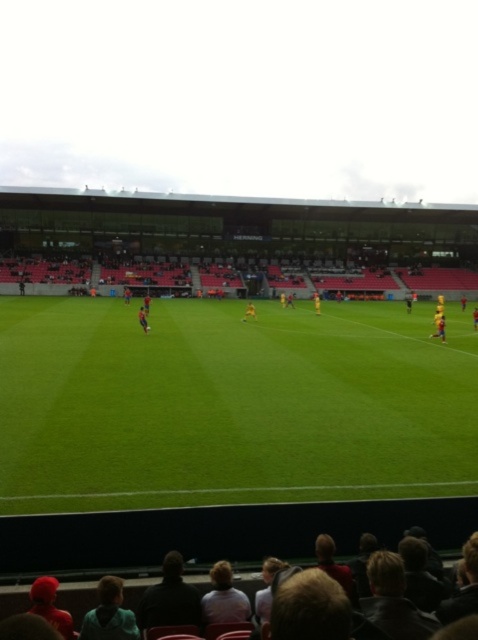
Between point (72, 496) and point (31, 611), which one is positioned behind?

The point (72, 496) is more distant.

At what (x,y) coordinates should I click in order to perform the action: click on green grass football field at center. Please return your answer as a coordinate pair (x, y). Looking at the image, I should click on (229, 404).

Consider the image. Does black fabric at lower center have a smaller size compared to yellow jersey at center?

Indeed, black fabric at lower center has a smaller size compared to yellow jersey at center.

Which is more to the right, black fabric at lower center or yellow jersey at center?

yellow jersey at center is more to the right.

Where is `black fabric at lower center`? The image size is (478, 640). black fabric at lower center is located at coordinates (170, 598).

Who is lower down, red knit cap at lower left or yellow jersey at center?

red knit cap at lower left is lower down.

Who is positioned more to the right, red knit cap at lower left or yellow jersey at center?

yellow jersey at center

At what (x,y) coordinates should I click in order to perform the action: click on red knit cap at lower left. Please return your answer as a coordinate pair (x, y). Looking at the image, I should click on (51, 605).